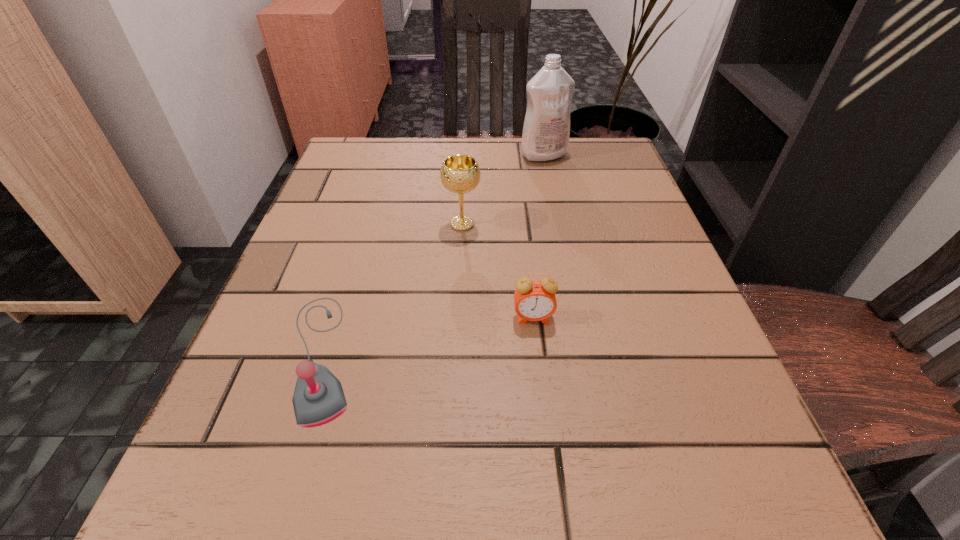
At what (x,y) coordinates should I click in order to perform the action: click on vacant area between the chalice and the joystick. Please return your answer as a coordinate pair (x, y). Looking at the image, I should click on (393, 290).

You are a GUI agent. You are given a task and a screenshot of the screen. Output one action in this format:
    pyautogui.click(x=<x>, y=<y>)
    Task: Click on the vacant area that lies between the joystick and the alarm clock
    Image resolution: width=960 pixels, height=540 pixels.
    Given the screenshot: What is the action you would take?
    pyautogui.click(x=428, y=337)

Image resolution: width=960 pixels, height=540 pixels. I want to click on free spot between the joystick and the alarm clock, so [x=428, y=337].

Where is `free space between the farthest object and the leftmost object`? free space between the farthest object and the leftmost object is located at coordinates click(433, 255).

At what (x,y) coordinates should I click in order to perform the action: click on free space between the alarm clock and the farthest object. Please return your answer as a coordinate pair (x, y). This screenshot has height=540, width=960. Looking at the image, I should click on (539, 237).

You are a GUI agent. You are given a task and a screenshot of the screen. Output one action in this format:
    pyautogui.click(x=<x>, y=<y>)
    Task: Click on the vacant point located between the alarm clock and the detergent
    Image resolution: width=960 pixels, height=540 pixels.
    Given the screenshot: What is the action you would take?
    pyautogui.click(x=539, y=237)

The image size is (960, 540). What are the coordinates of `vacant space in between the joystick and the alarm clock` in the screenshot? It's located at click(428, 337).

Find the location of a particular element. The height and width of the screenshot is (540, 960). vacant area between the alarm clock and the tallest object is located at coordinates (539, 237).

Where is `free area in between the chalice and the alarm clock`? The width and height of the screenshot is (960, 540). free area in between the chalice and the alarm clock is located at coordinates [x=497, y=271].

You are a GUI agent. You are given a task and a screenshot of the screen. Output one action in this format:
    pyautogui.click(x=<x>, y=<y>)
    Task: Click on the free space between the joystick and the second object from left to right
    This screenshot has width=960, height=540.
    Given the screenshot: What is the action you would take?
    pyautogui.click(x=393, y=290)